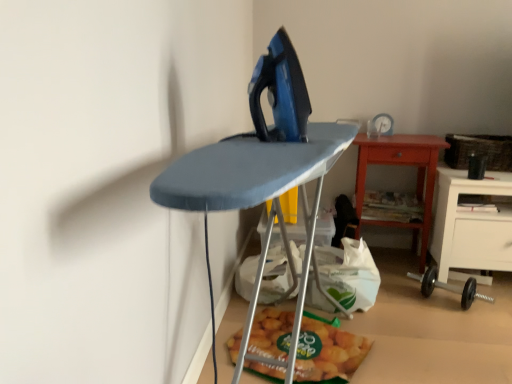
Question: Do you think blue fabric ironing board at center is within black rubber dumbbell at lower right, or outside of it?

Choices:
 (A) inside
 (B) outside

Answer: (B)

Question: Relative to black rubber dumbbell at lower right, is blue fabric ironing board at center in front or behind?

Choices:
 (A) behind
 (B) front

Answer: (B)

Question: Which is farther from the white plastic grocery bag at lower center?

Choices:
 (A) black rubber dumbbell at lower right
 (B) matte plastic bag of chips at lower center
 (C) blue fabric ironing board at center
 (D) woven brown basket at right
 (E) wooden table at center right

Answer: (D)

Question: Based on their relative distances, which object is farther from the white plastic grocery bag at lower center?

Choices:
 (A) woven brown basket at right
 (B) blue fabric ironing board at center
 (C) matte plastic bag of chips at lower center
 (D) wooden table at center right
 (E) black rubber dumbbell at lower right

Answer: (A)